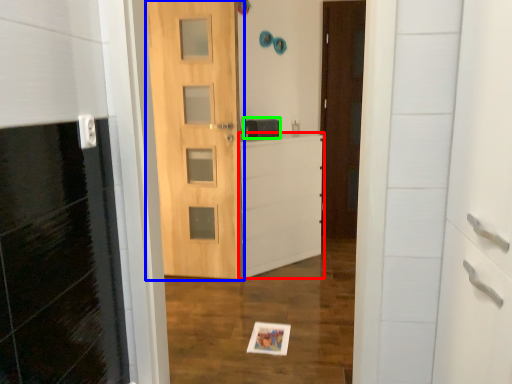
Question: Which is nearer to the file cabinet (highlighted by a red box)? door (highlighted by a blue box) or medicine cabinet (highlighted by a green box).

Choices:
 (A) door
 (B) medicine cabinet

Answer: (A)